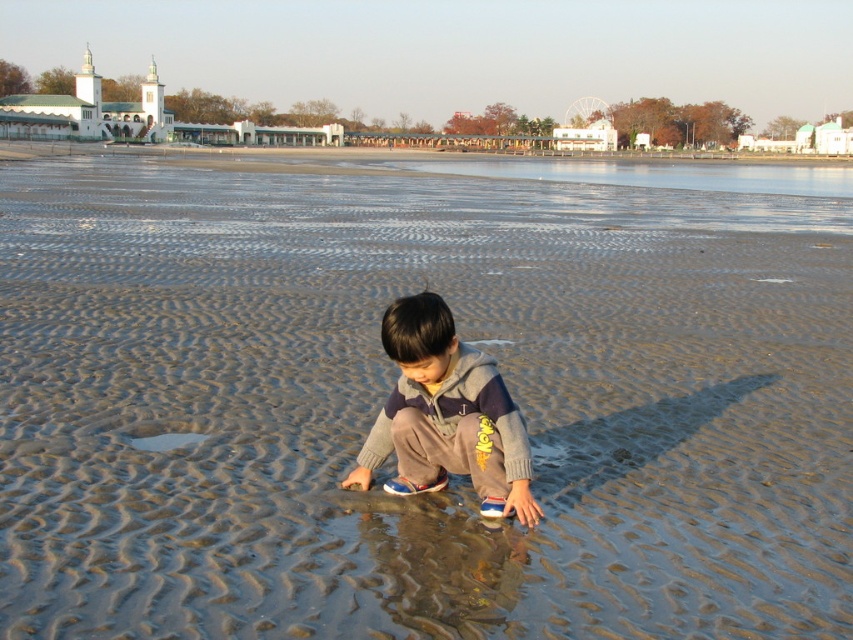
You are a beachgoer who wants to lay out a 2 meter long towel. You see the gray fleece jacket at center and the clear water at upper center. Which area has enough space to accommodate the towel?

The clear water at upper center has a width greater than the gray fleece jacket at center, so the clear water at upper center can accommodate the 2 meter long towel.